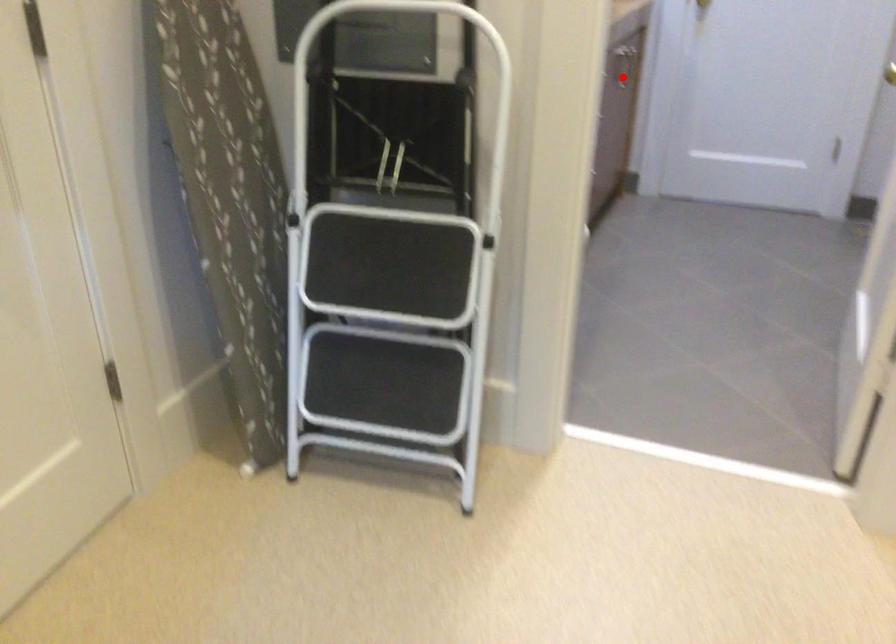
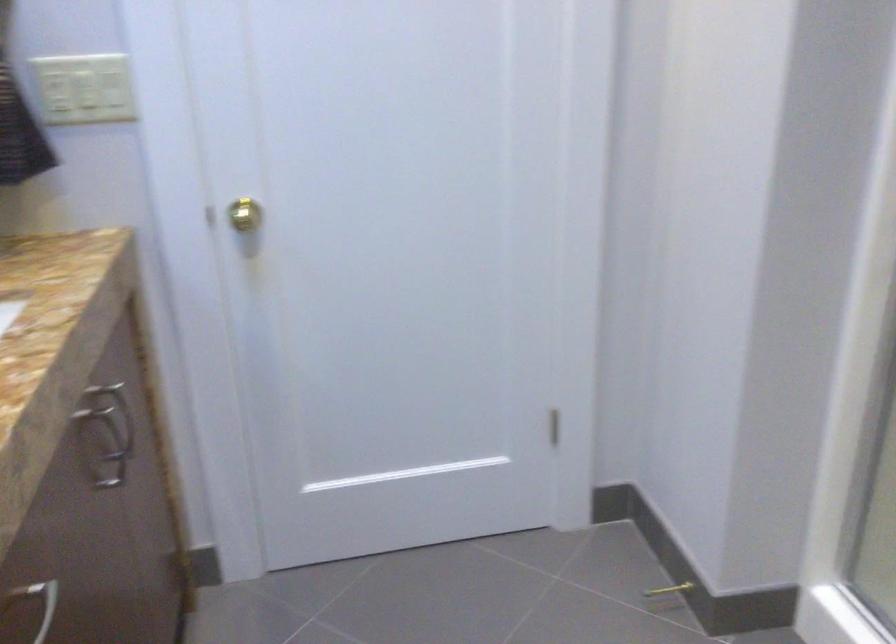
Question: I am providing you with two images of the same scene from different viewpoints. A red point is shown in image1. For the corresponding object point in image2, is it positioned nearer or farther from the camera?

Choices:
 (A) Nearer
 (B) Farther

Answer: (A)